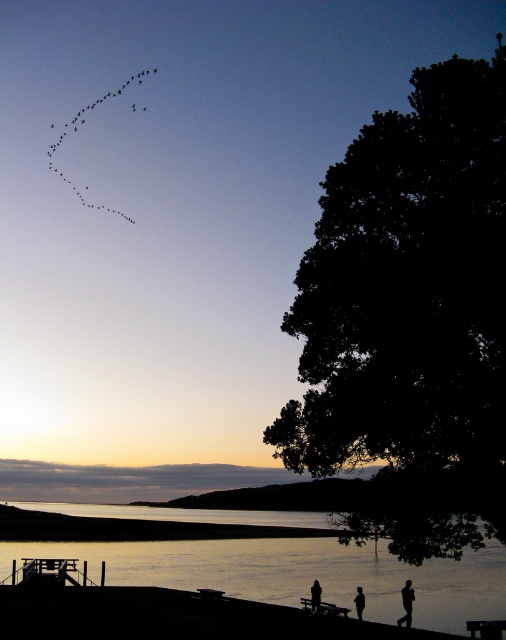
You are a photographer trying to capture the sunset scene. You want to ensure that both the dark silhouette tree at right and the black matte birds at upper left are fully visible in your shot. Based on their sizes, is there a risk that one might be cropped out if you frame the image to focus on the other?

The dark silhouette tree at right might be wider than black matte birds at upper left, so if you focus the frame on the tree, the birds at upper left could be at risk of being cropped out since the tree is wider and occupies more space in the composition.

You are a photographer standing at the lakeside, and you want to capture both the silhouette running man at lower right and the black matte person at lower center in the same frame. Given that your camera has a 50mm lens with a field of view that can cover 10 feet at this distance, will you be able to include both subjects in your photo?

The silhouette running man at lower right and the black matte person at lower center are 14.13 feet apart. Since the camera lens can only cover 10 feet, the distance between them exceeds the field of view, so you won